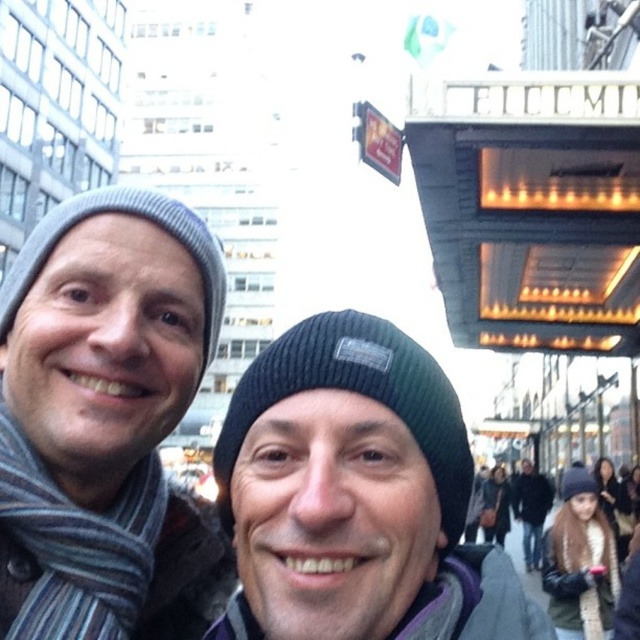
Who is higher up, black knit beanie at center or striped wool scarf at left?

striped wool scarf at left

Can you confirm if black knit beanie at center is smaller than striped wool scarf at left?

No.

Does point (253, 486) lie in front of point (97, 554)?

No.

The width and height of the screenshot is (640, 640). Find the location of `black knit beanie at center`. black knit beanie at center is located at coordinates (356, 496).

From the picture: Is gray knit beanie at left positioned before brown fur coat at lower right?

That is True.

Who is more distant from viewer, [161,272] or [568,561]?

Positioned behind is point [568,561].

Is point (131, 488) in front of point (588, 595)?

Yes, it is in front of point (588, 595).

Find the location of a particular element. The height and width of the screenshot is (640, 640). gray knit beanie at left is located at coordinates (99, 424).

Who is positioned more to the left, gray knit beanie at left or black woolen hat at lower right?

From the viewer's perspective, gray knit beanie at left appears more on the left side.

Is the position of gray knit beanie at left more distant than that of black woolen hat at lower right?

No.

This screenshot has height=640, width=640. In order to click on gray knit beanie at left in this screenshot , I will do `click(99, 424)`.